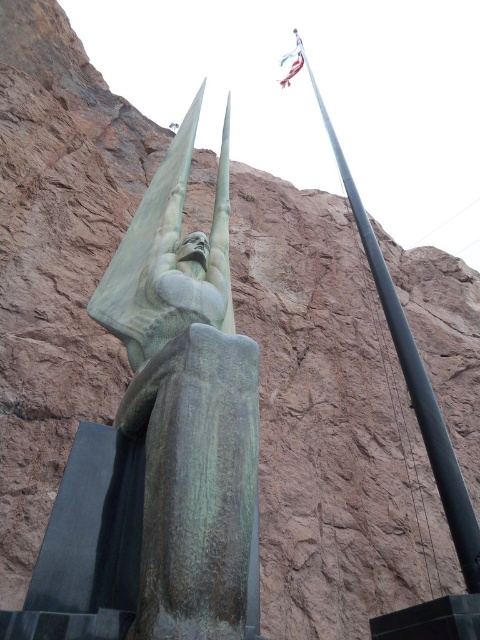
Who is taller, green patina statue at center or black metallic pole at upper right?

black metallic pole at upper right is taller.

Which is more to the right, green patina statue at center or black metallic pole at upper right?

black metallic pole at upper right

Who is more forward, [127,428] or [373,266]?

Point [127,428] is in front.

At what (x,y) coordinates should I click in order to perform the action: click on green patina statue at center. Please return your answer as a coordinate pair (x, y). The width and height of the screenshot is (480, 640). Looking at the image, I should click on (187, 403).